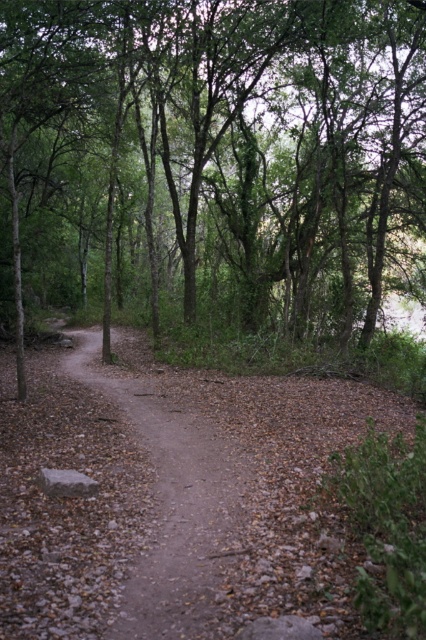
Is dusty brown dirt track at center wider than dirt path at center?

Yes, dusty brown dirt track at center is wider than dirt path at center.

From the picture: Is dusty brown dirt track at center positioned at the back of dirt path at center?

That is False.

Is point (167, 595) positioned in front of point (204, 602)?

No.

Where is `dusty brown dirt track at center`? The image size is (426, 640). dusty brown dirt track at center is located at coordinates (175, 497).

Does green leafy tree at center appear over dusty brown dirt track at center?

Yes, green leafy tree at center is above dusty brown dirt track at center.

Is green leafy tree at center positioned before dusty brown dirt track at center?

No.

Find the location of a particular element. This screenshot has height=640, width=426. green leafy tree at center is located at coordinates (213, 168).

Is green leafy tree at center positioned at the back of dirt path at center?

Yes.

Based on the photo, between green leafy tree at center and dirt path at center, which one is positioned lower?

dirt path at center is lower down.

Who is more forward, (167,208) or (146,406)?

Result: Point (146,406) is in front.

Locate an element on the screen. This screenshot has height=640, width=426. green leafy tree at center is located at coordinates (213, 168).